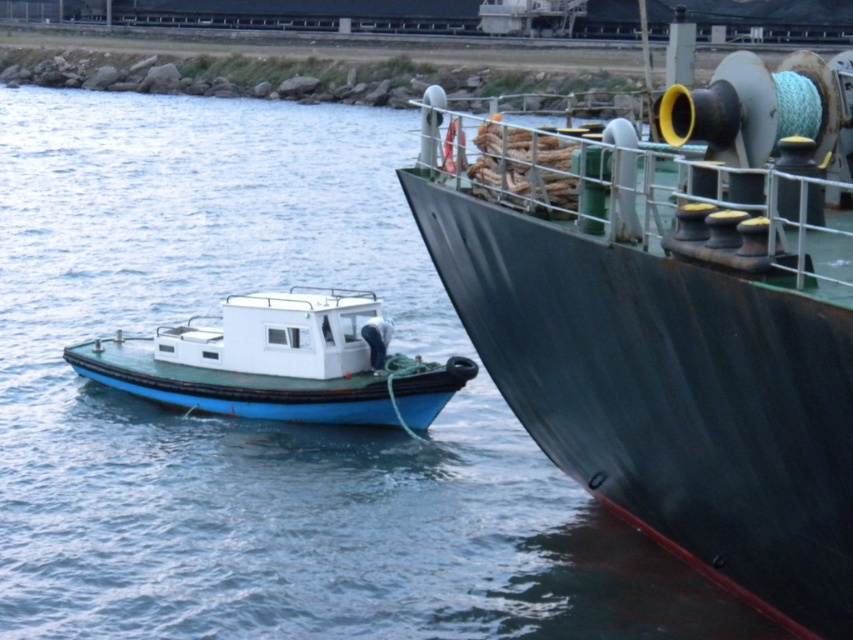
Which is behind, point (763, 237) or point (367, 292)?

The point (367, 292) is behind.

Which is in front, point (558, 381) or point (331, 317)?

Point (558, 381)

Find the location of a particular element. This screenshot has height=640, width=853. rusty metal ship at right is located at coordinates (672, 314).